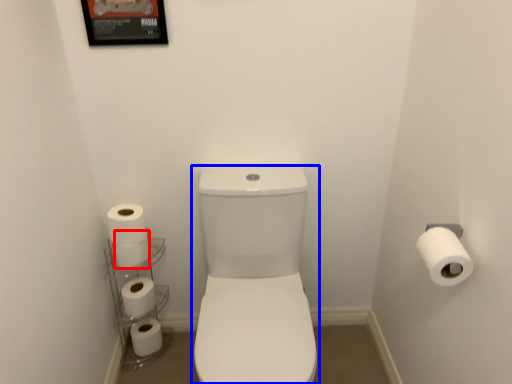
Question: Among these objects, which one is farthest to the camera, toilet paper (highlighted by a red box) or toilet bowl (highlighted by a blue box)?

Choices:
 (A) toilet paper
 (B) toilet bowl

Answer: (A)